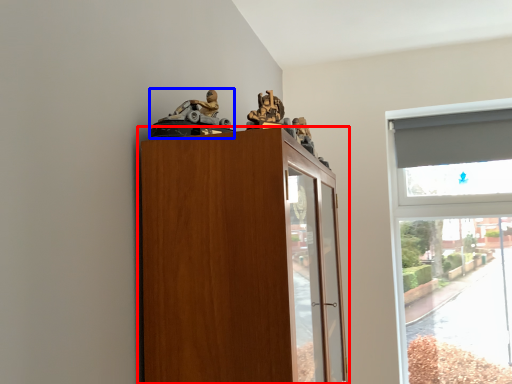
Question: Which point is closer to the camera, cupboard (highlighted by a red box) or toy (highlighted by a blue box)?

Choices:
 (A) cupboard
 (B) toy

Answer: (A)